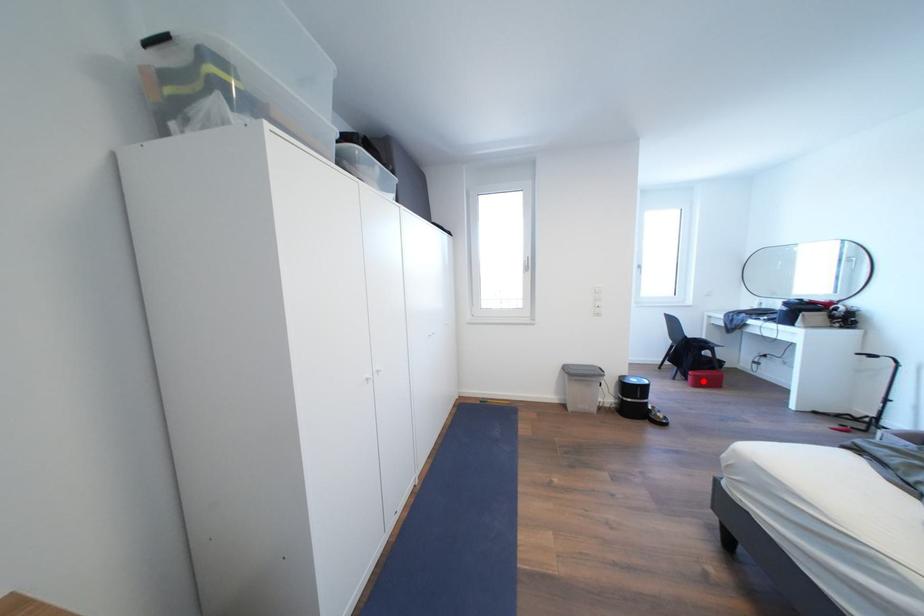
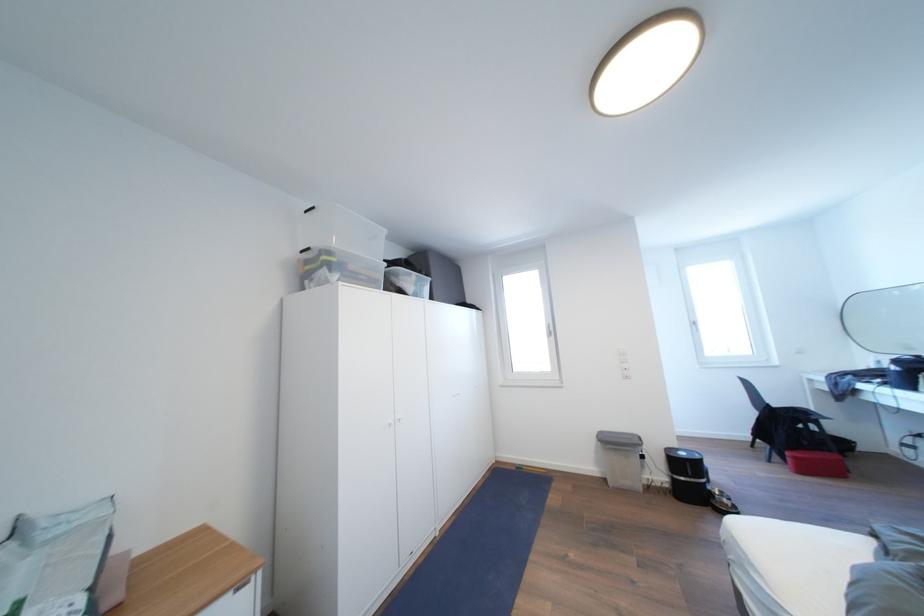
Question: I am providing you with two images of the same scene from different viewpoints. A red point is marked on the first image. At the location where the point appears in image 1, is it still visible in image 2?

Choices:
 (A) Yes
 (B) No

Answer: (A)